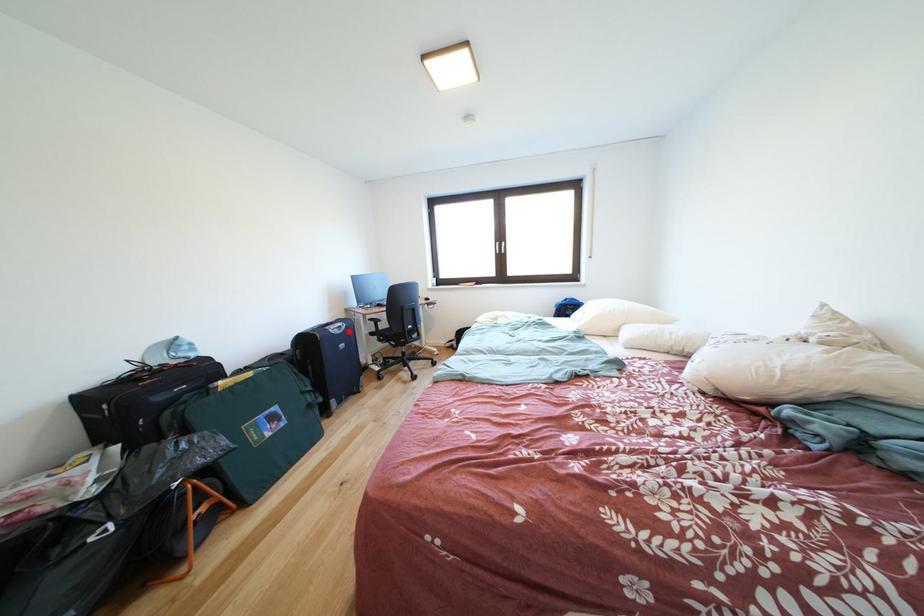
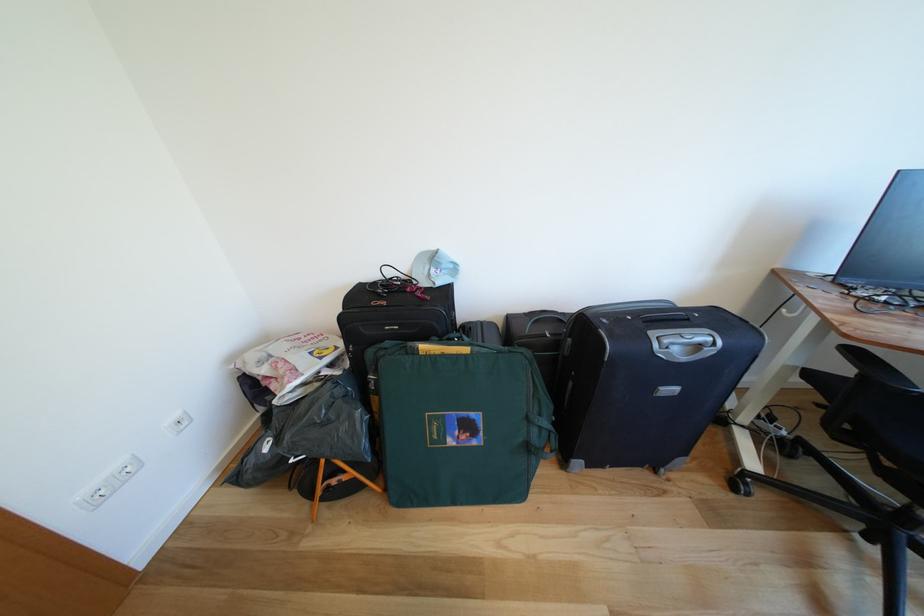
Question: I am providing you with two images of the same scene from different viewpoints. A red point is shown in image1. For the corresponding object point in image2, is it positioned nearer or farther from the camera?

Choices:
 (A) Nearer
 (B) Farther

Answer: (B)